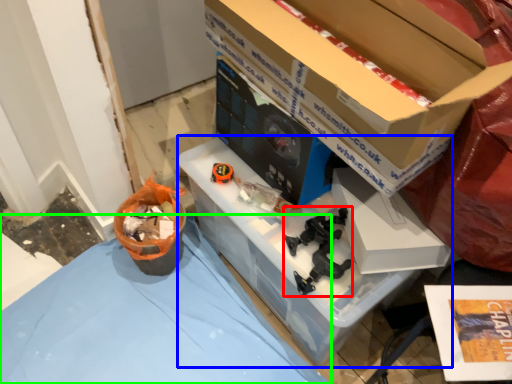
Question: Considering the real-world distances, which object is farthest from toy (highlighted by a red box)? storage box (highlighted by a blue box) or tablecloth (highlighted by a green box)?

Choices:
 (A) storage box
 (B) tablecloth

Answer: (B)